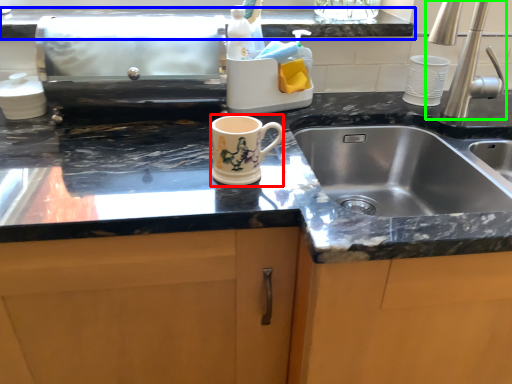
Question: Considering the real-world distances, which object is farthest from mug (highlighted by a red box)? countertop (highlighted by a blue box) or tap (highlighted by a green box)?

Choices:
 (A) countertop
 (B) tap

Answer: (B)